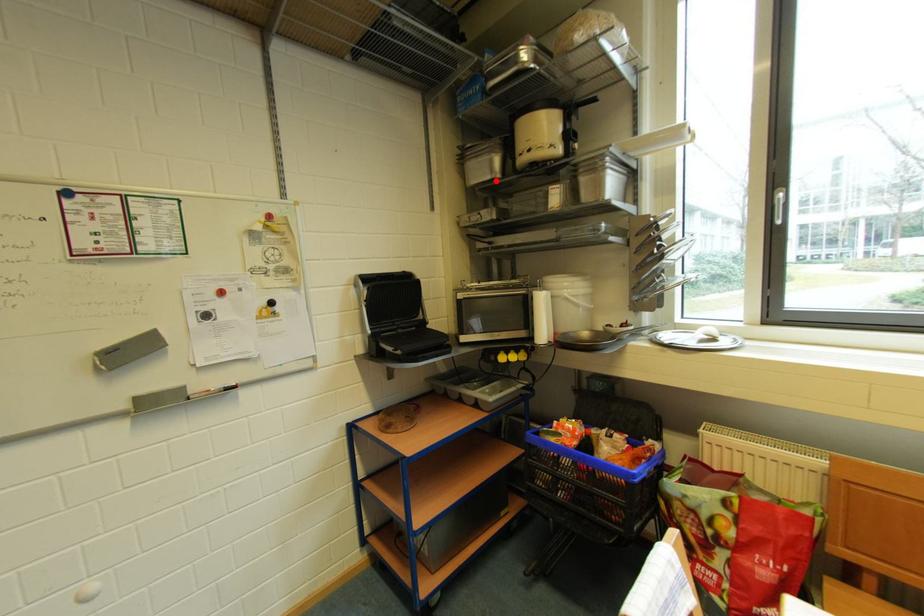
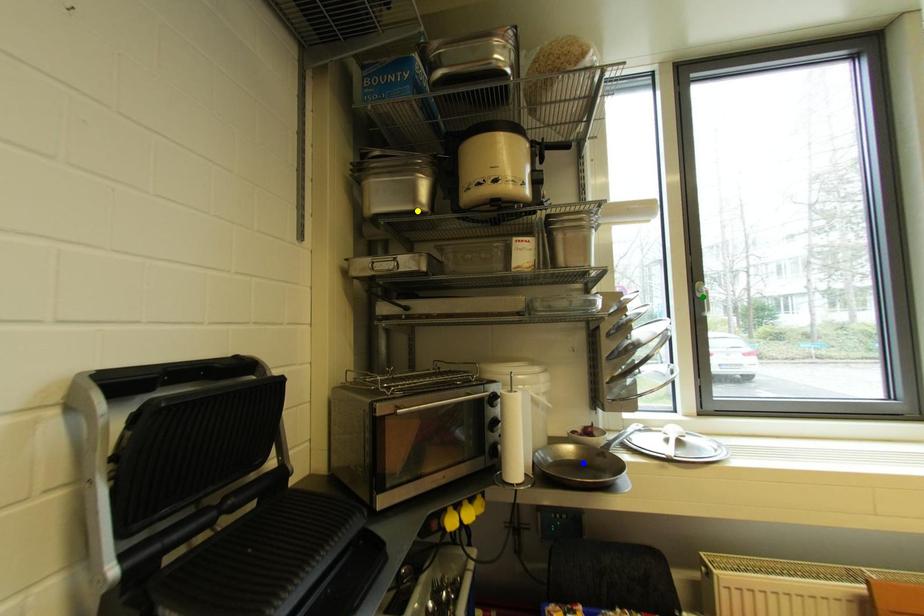
Question: I am providing you with two images of the same scene from different viewpoints. A red point is marked on the first image. You are given multiple points on the second image. Can you choose the point in image 2 that corresponds to the point in image 1?

Choices:
 (A) yellow point
 (B) blue point
 (C) green point

Answer: (A)